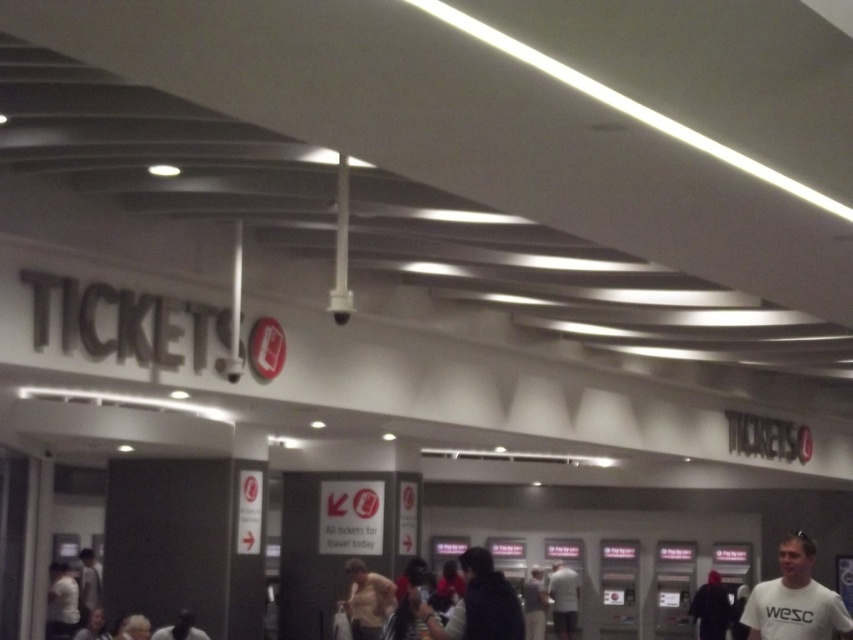
Question: Does white t-shirt at lower right appear under light gray shirt at lower left?

Choices:
 (A) yes
 (B) no

Answer: (B)

Question: Which point is farther from the camera taking this photo?

Choices:
 (A) (566, 630)
 (B) (363, 598)
 (C) (88, 605)
 (D) (811, 632)

Answer: (A)

Question: Which is farther from the light gray shirt at lower left?

Choices:
 (A) white t-shirt at lower right
 (B) white matte shirt at center

Answer: (A)

Question: Can you confirm if light beige shirt at center is positioned above light gray shirt at lower left?

Choices:
 (A) no
 (B) yes

Answer: (B)

Question: Considering the real-world distances, which object is farthest from the white t-shirt at lower right?

Choices:
 (A) light gray shirt at lower left
 (B) light beige shirt at center
 (C) white matte shirt at center

Answer: (A)

Question: Is white t-shirt at lower right to the left of white matte shirt at center from the viewer's perspective?

Choices:
 (A) no
 (B) yes

Answer: (B)